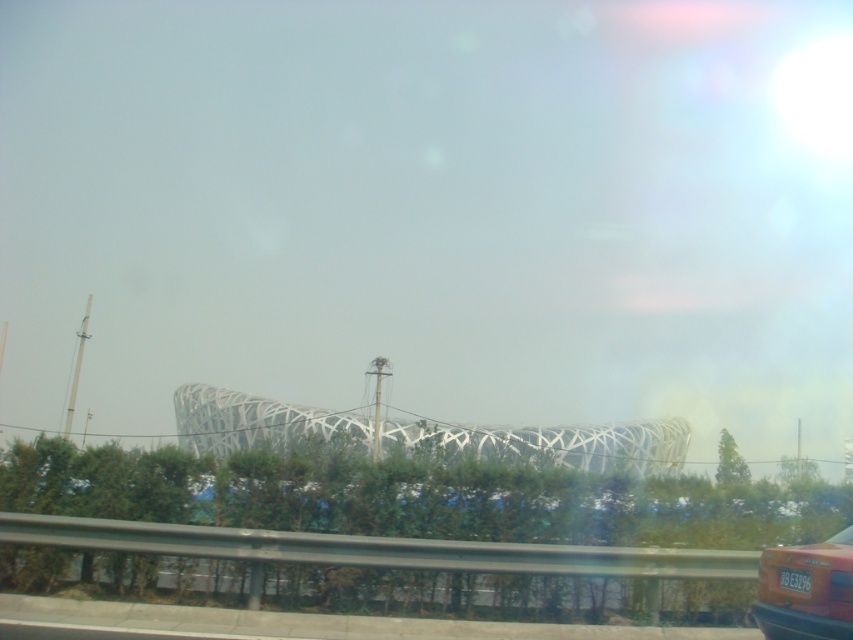
You are a passenger in a car driving past the Bird Nest stadium. You want to take a photo of the white plastic license plate at lower right and the transparent glass car window at lower right through the window. Which object will appear smaller in your photo?

The white plastic license plate at lower right will appear smaller in the photo because it has a smaller size compared to the transparent glass car window at lower right.

You are standing next to the matte red car at lower right and want to take a clear photo of the National Stadium Bird Nest in the distance. Considering the current position, will the strip of greenery in the foreground block your view of the Bird Nest?

The matte red car at lower right is 5.32 meters away from the viewer. Since the car is positioned at the lower right and the greenery is in the foreground, the greenery strip may partially block the view of the Bird Nest. To ensure a clear shot, move forward or adjust your angle to avoid the obstruction caused by the greenery strip.

You are a passenger in a car and want to take a photo of the Bird Nest stadium through the transparent glass car window at lower right. However, there is a matte red car at lower right blocking your view. Can you still take the photo by moving your head slightly?

The matte red car at lower right is in front of the transparent glass car window at lower right, so moving your head might allow you to see around the obstruction and take the photo.